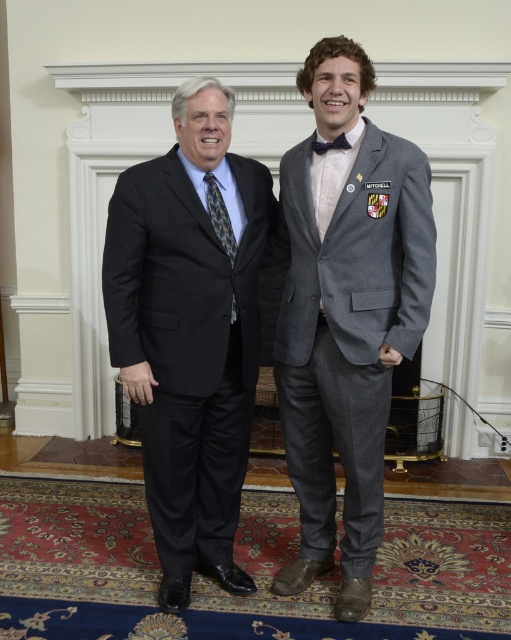
Question: Can you confirm if matte black suit at left is wider than gray wool suit at right?

Choices:
 (A) no
 (B) yes

Answer: (B)

Question: Which is farther from the patterned silk tie at center?

Choices:
 (A) black wool suit at center
 (B) matte black bow tie at center
 (C) matte black suit at left
 (D) gray wool suit at right

Answer: (D)

Question: Which point is farther to the camera?

Choices:
 (A) black wool suit at center
 (B) gray wool suit at right
 (C) patterned silk tie at center
 (D) matte black suit at left

Answer: (C)

Question: Can you confirm if gray wool suit at right is positioned above patterned silk tie at center?

Choices:
 (A) no
 (B) yes

Answer: (A)

Question: Can you confirm if gray wool suit at right is positioned to the left of patterned silk tie at center?

Choices:
 (A) no
 (B) yes

Answer: (A)

Question: Which point appears farthest from the camera in this image?

Choices:
 (A) (357, 122)
 (B) (333, 145)

Answer: (B)